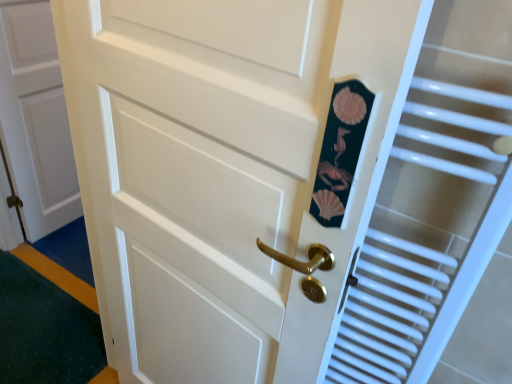
Question: From the image's perspective, does white matte door at left appear lower than white plastic radiator at right?

Choices:
 (A) no
 (B) yes

Answer: (A)

Question: Considering the relative positions of white matte door at left and white plastic radiator at right in the image provided, is white matte door at left to the right of white plastic radiator at right from the viewer's perspective?

Choices:
 (A) no
 (B) yes

Answer: (A)

Question: From a real-world perspective, is white matte door at left beneath white plastic radiator at right?

Choices:
 (A) yes
 (B) no

Answer: (A)

Question: From the image's perspective, is white matte door at left on top of white plastic radiator at right?

Choices:
 (A) no
 (B) yes

Answer: (B)

Question: Is white matte door at left further to the viewer compared to white plastic radiator at right?

Choices:
 (A) no
 (B) yes

Answer: (B)

Question: Can you confirm if white matte door at left is bigger than white plastic radiator at right?

Choices:
 (A) no
 (B) yes

Answer: (B)

Question: Is white plastic radiator at right positioned before white matte door at left?

Choices:
 (A) yes
 (B) no

Answer: (A)

Question: Is white plastic radiator at right far from white matte door at left?

Choices:
 (A) yes
 (B) no

Answer: (A)

Question: Is white plastic radiator at right located outside white matte door at left?

Choices:
 (A) yes
 (B) no

Answer: (A)

Question: Does white plastic radiator at right come behind white matte door at left?

Choices:
 (A) no
 (B) yes

Answer: (A)

Question: From a real-world perspective, does white plastic radiator at right stand above white matte door at left?

Choices:
 (A) yes
 (B) no

Answer: (A)

Question: Does white plastic radiator at right have a greater width compared to white matte door at left?

Choices:
 (A) yes
 (B) no

Answer: (A)

Question: Visually, is white plastic radiator at right positioned to the left or to the right of white matte door at left?

Choices:
 (A) left
 (B) right

Answer: (B)